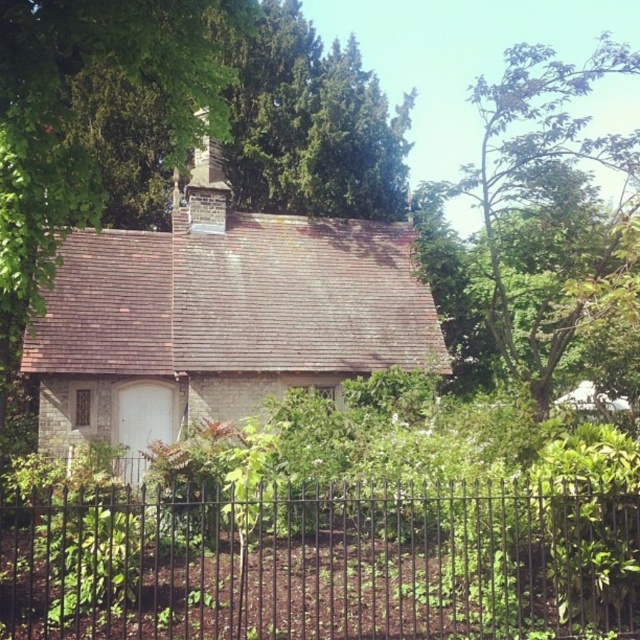
Can you confirm if brick cottage at center is positioned below brick chimney at center?

Yes, brick cottage at center is below brick chimney at center.

Identify the location of brick cottage at center. Image resolution: width=640 pixels, height=640 pixels. (218, 323).

Describe the element at coordinates (218, 323) in the screenshot. I see `brick cottage at center` at that location.

Where is `brick cottage at center`? The height and width of the screenshot is (640, 640). brick cottage at center is located at coordinates (218, 323).

Between black wrought iron fence at lower center and brick cottage at center, which one is positioned lower?

Positioned lower is black wrought iron fence at lower center.

Is the position of black wrought iron fence at lower center less distant than that of brick cottage at center?

Yes.

This screenshot has width=640, height=640. What do you see at coordinates (317, 563) in the screenshot?
I see `black wrought iron fence at lower center` at bounding box center [317, 563].

At what (x,y) coordinates should I click in order to perform the action: click on black wrought iron fence at lower center. Please return your answer as a coordinate pair (x, y). Image resolution: width=640 pixels, height=640 pixels. Looking at the image, I should click on (317, 563).

Between black wrought iron fence at lower center and brick chimney at center, which one appears on the right side from the viewer's perspective?

From the viewer's perspective, black wrought iron fence at lower center appears more on the right side.

Between point (556, 598) and point (198, 150), which one is positioned behind?

Point (198, 150)

Locate an element on the screen. black wrought iron fence at lower center is located at coordinates (317, 563).